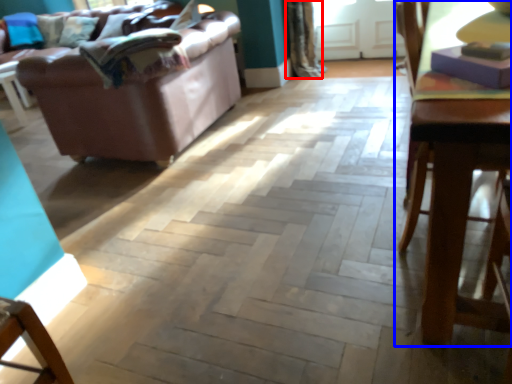
Question: Which object is further to the camera taking this photo, curtain (highlighted by a red box) or table (highlighted by a blue box)?

Choices:
 (A) curtain
 (B) table

Answer: (A)